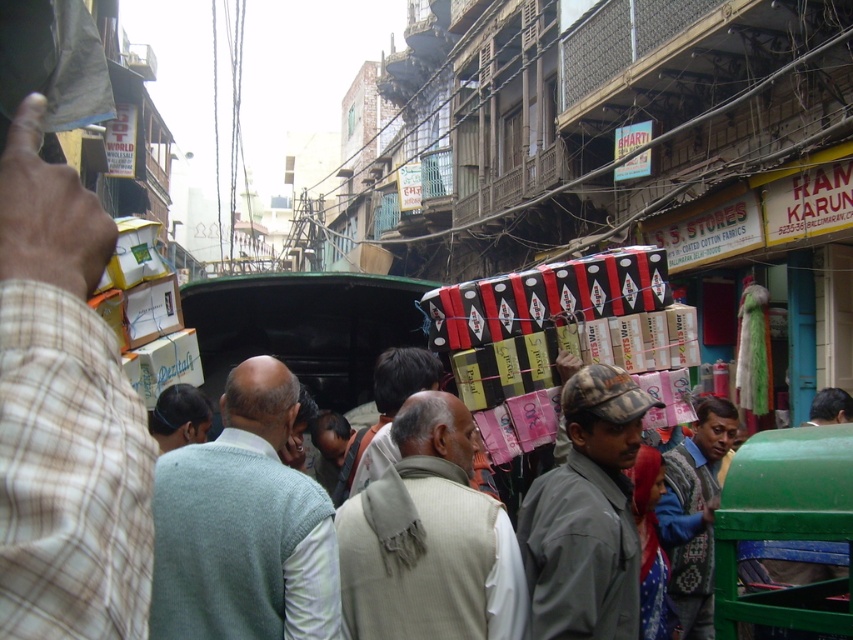
Question: Which object is positioned farthest from the light gray sweater at center?

Choices:
 (A) dark brown hair at center
 (B) knitted sweater at center
 (C) camouflage fabric cap at center
 (D) beige woolen vest at center

Answer: (B)

Question: Considering the relative positions of beige woolen vest at center and camouflage fabric cap at center in the image provided, where is beige woolen vest at center located with respect to camouflage fabric cap at center?

Choices:
 (A) left
 (B) right

Answer: (A)

Question: Considering the real-world distances, which object is closest to the knitted sweater at center?

Choices:
 (A) light gray sweater at center
 (B) dark brown hair at center
 (C) camouflage fabric cap at center

Answer: (C)

Question: Does light gray sweater at center appear on the left side of camouflage fabric cap at center?

Choices:
 (A) yes
 (B) no

Answer: (A)

Question: Does beige woolen vest at center appear on the left side of dark brown hair at center?

Choices:
 (A) no
 (B) yes

Answer: (A)

Question: Which object is the closest to the light gray sweater at center?

Choices:
 (A) beige woolen vest at center
 (B) dark brown hair at center

Answer: (A)